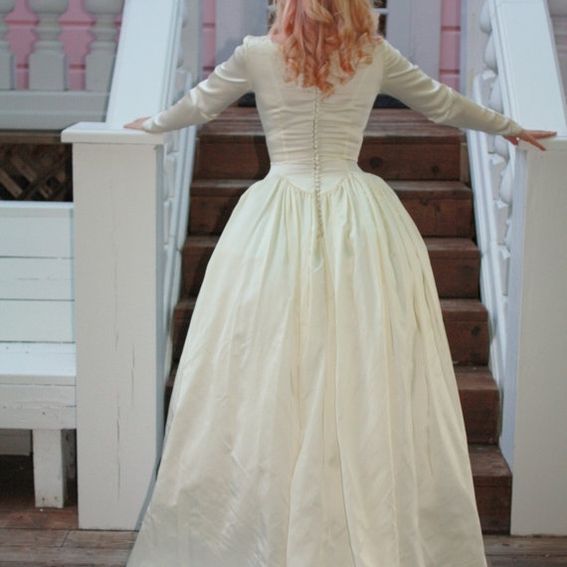
Where is `doormat`? The width and height of the screenshot is (567, 567). doormat is located at coordinates [x=389, y=103].